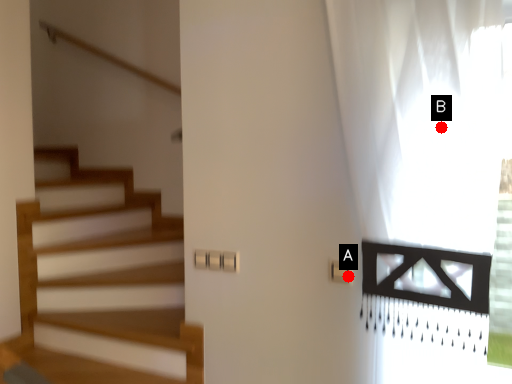
Question: Two points are circled on the image, labeled by A and B beside each circle. Which point is farther to the camera?

Choices:
 (A) A is further
 (B) B is further

Answer: (A)